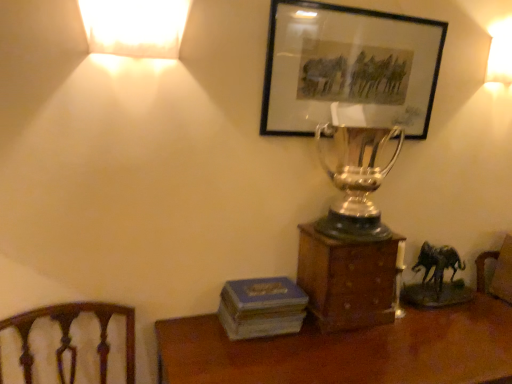
The height and width of the screenshot is (384, 512). Identify the location of free area in between blue matte book at lower center and wooden box at center. (298, 338).